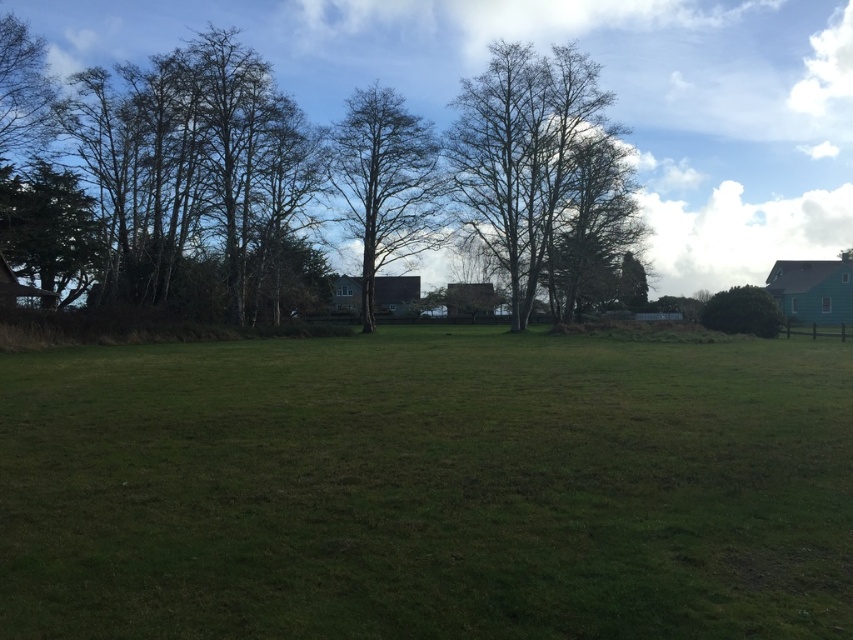
Question: Which of these objects is positioned closest to the bare branches at upper center?

Choices:
 (A) bare branches at center
 (B) bare wood tree at center
 (C) green leafy bush at right

Answer: (A)

Question: Which point is farther to the camera?

Choices:
 (A) (97, 221)
 (B) (519, 83)

Answer: (B)

Question: Is bare branches at center to the left of green leafy bush at right from the viewer's perspective?

Choices:
 (A) yes
 (B) no

Answer: (A)

Question: Considering the relative positions of bare branches at upper center and bare wood tree at center in the image provided, where is bare branches at upper center located with respect to bare wood tree at center?

Choices:
 (A) right
 (B) left

Answer: (B)

Question: Which object is farther from the camera taking this photo?

Choices:
 (A) green grass at center
 (B) green textured tree at left

Answer: (B)

Question: Does green grass at center have a larger size compared to bare branches at center?

Choices:
 (A) no
 (B) yes

Answer: (A)